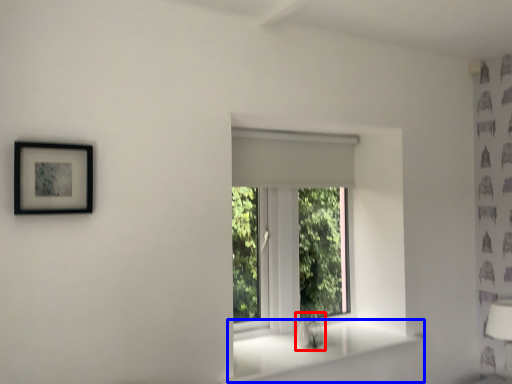
Question: Which object appears closest to the camera in this image, sink (highlighted by a red box) or window sill (highlighted by a blue box)?

Choices:
 (A) sink
 (B) window sill

Answer: (B)